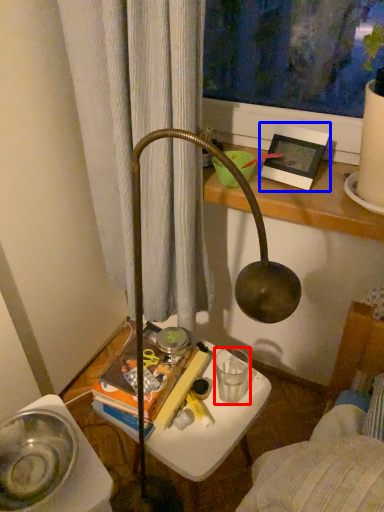
Question: Which object is closer to the camera taking this photo, beverage (highlighted by a red box) or picture frame (highlighted by a blue box)?

Choices:
 (A) beverage
 (B) picture frame

Answer: (B)